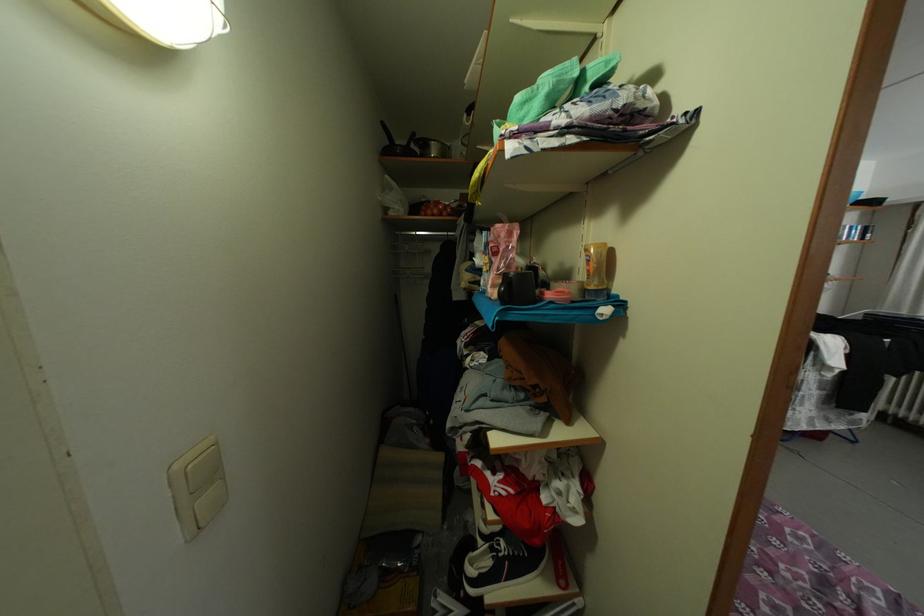
The location [594,270] corresponds to which object?

This point indicates the orange squeeze bottle.